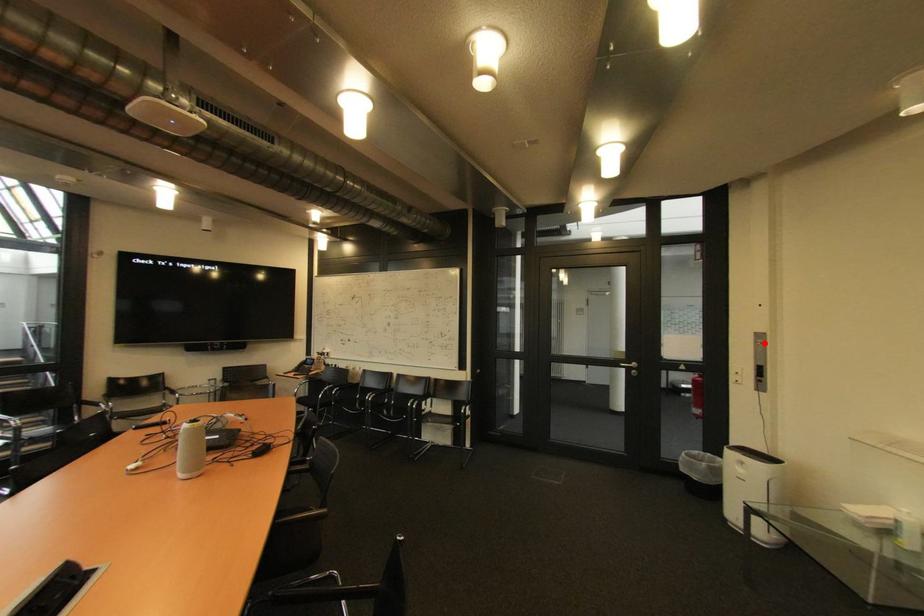
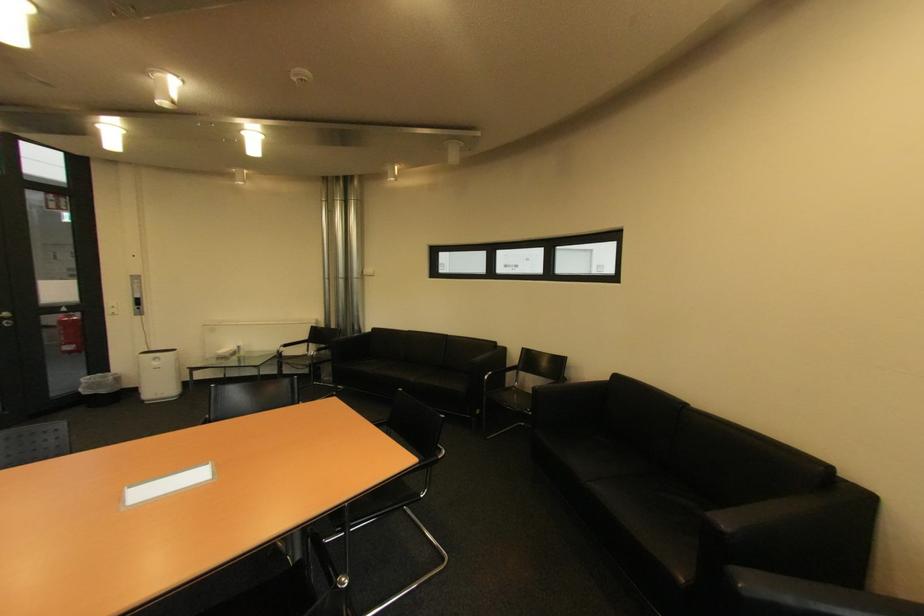
The point at the highlighted location is marked in the first image. Where is the corresponding point in the second image?

(140, 283)